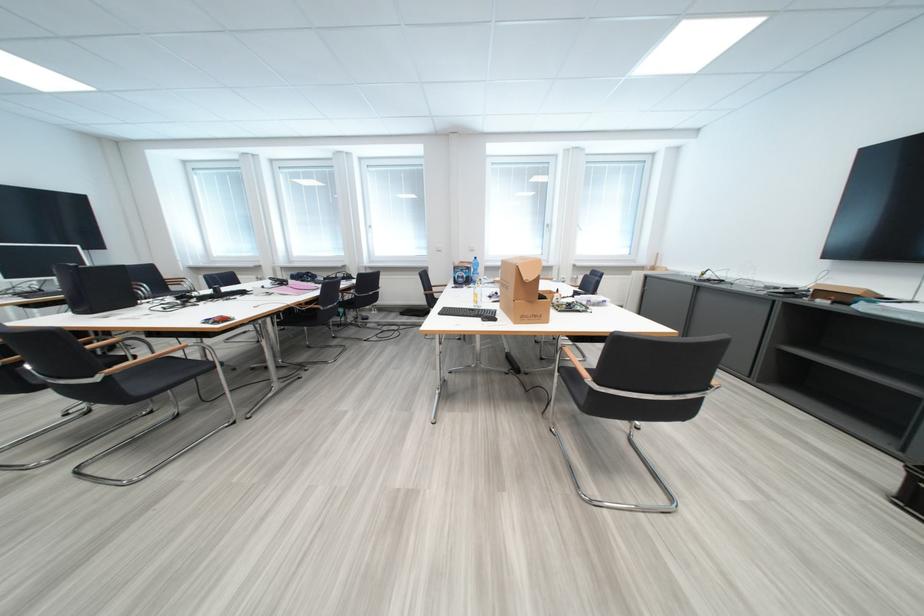
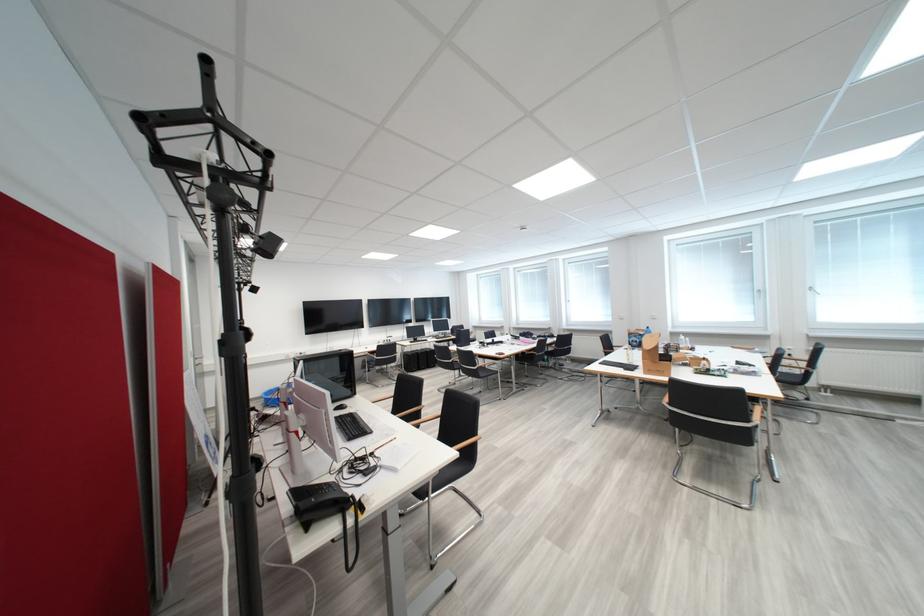
The point at (x=479, y=270) is marked in the first image. Where is the corresponding point in the second image?

(650, 337)